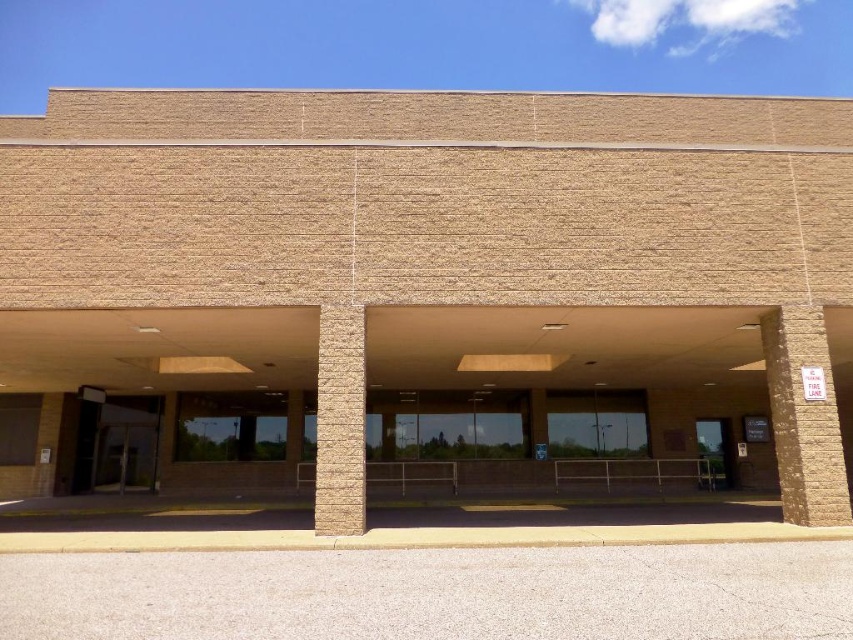
Question: Considering the real-world distances, which object is closest to the brown brick pillar at right?

Choices:
 (A) beige textured pillar at center
 (B) brown brick pillar at left

Answer: (A)

Question: Does brown brick pillar at right appear on the left side of beige textured pillar at center?

Choices:
 (A) no
 (B) yes

Answer: (A)

Question: Which object is positioned farthest from the brown brick pillar at left?

Choices:
 (A) brown brick pillar at right
 (B) beige textured pillar at center

Answer: (A)

Question: Does brown brick pillar at right appear on the right side of brown brick pillar at left?

Choices:
 (A) yes
 (B) no

Answer: (A)

Question: Estimate the real-world distances between objects in this image. Which object is closer to the brown brick pillar at left?

Choices:
 (A) beige textured pillar at center
 (B) brown brick pillar at right

Answer: (A)

Question: Is brown brick pillar at right bigger than brown brick pillar at left?

Choices:
 (A) yes
 (B) no

Answer: (A)